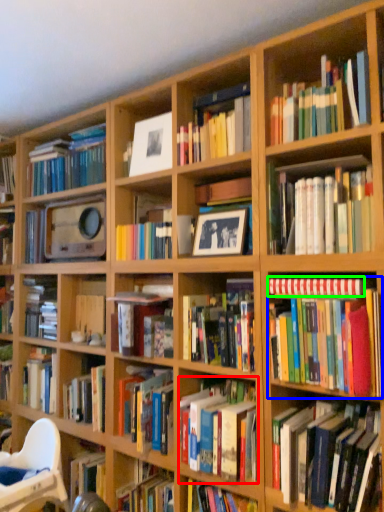
Question: Which object is the farthest from book (highlighted by a red box)? Choose among these: book (highlighted by a blue box) or book (highlighted by a green box).

Choices:
 (A) book
 (B) book

Answer: (B)